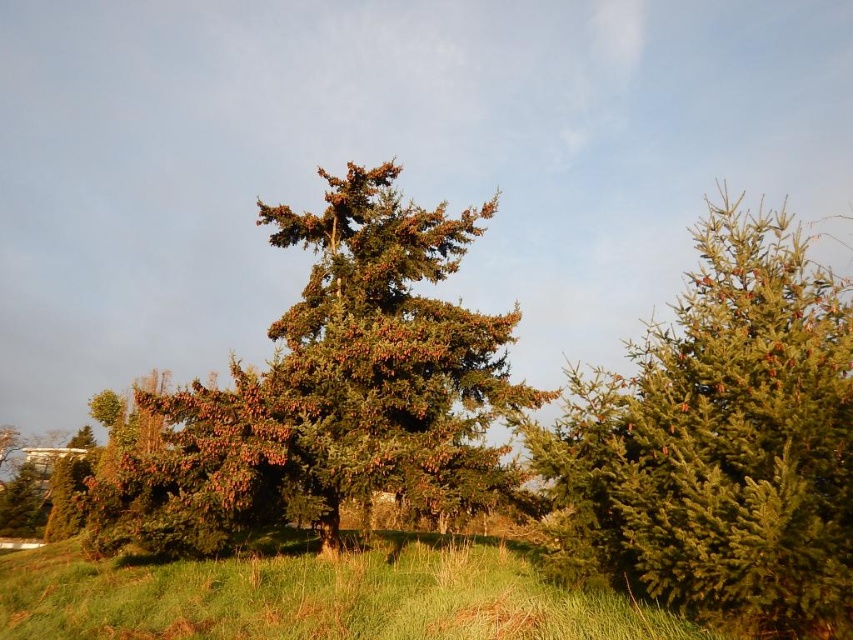
You are a gardener who needs to water the green matte evergreen tree at right and the green grass at center. Your watering can holds enough water to cover 5 meters. Can you water both areas without refilling?

The green matte evergreen tree at right and green grass at center are 5.38 meters apart. Since the distance exceeds the watering can capacity of 5 meters, you cannot water both areas without refilling.

You are standing in the middle of the scene and see the green matte evergreen tree at right and the green textured tree at center. Which tree is positioned farther to the east?

The green matte evergreen tree at right is positioned to the right of the green textured tree at center, so it is farther to the east.